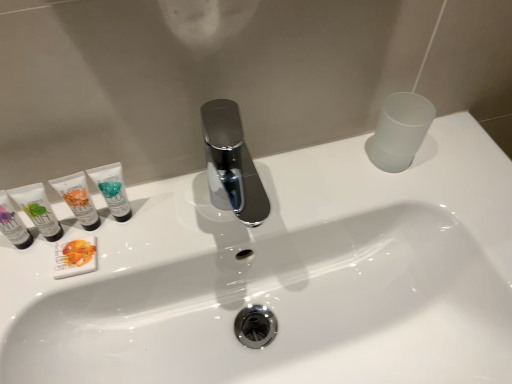
The height and width of the screenshot is (384, 512). Find the location of `unoccupied region to the right of white matte soap bar at left, the 3th toiletry from the left`. unoccupied region to the right of white matte soap bar at left, the 3th toiletry from the left is located at coordinates (181, 231).